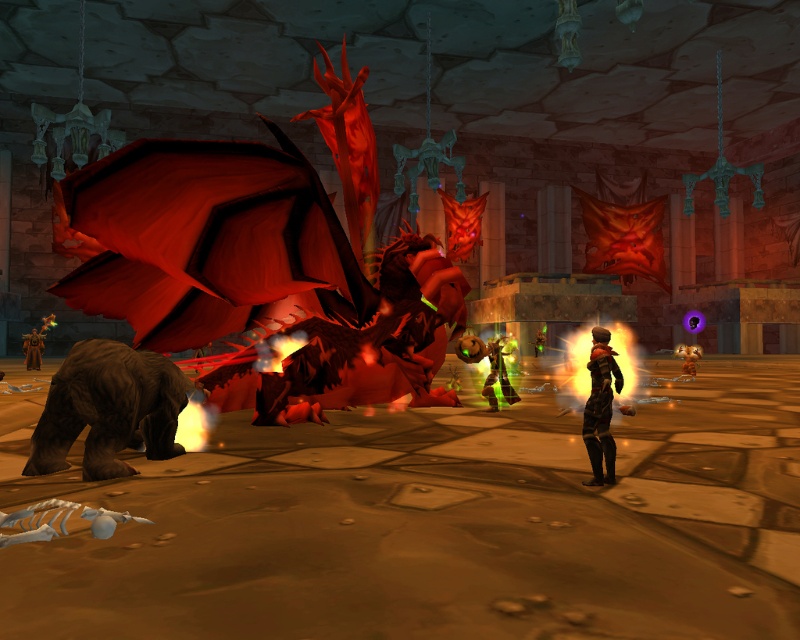
You are a knight in the chamber and notice two armors in the center. Which armor is closer to you, the dark brown leather armor at center or the green metallic armor at center?

The dark brown leather armor at center is closer to you because it is in front of the green metallic armor at center.

You are a knight preparing to enter the chamber. You see the brown leather armor at center and the smooth leather boots at lower right. Which item should you pick up first if you want to put on your gear in the most efficient way possible?

The brown leather armor at center is larger in size than the smooth leather boots at lower right, so you should pick up the smooth leather boots at lower right first to ensure proper layering when putting on your gear.